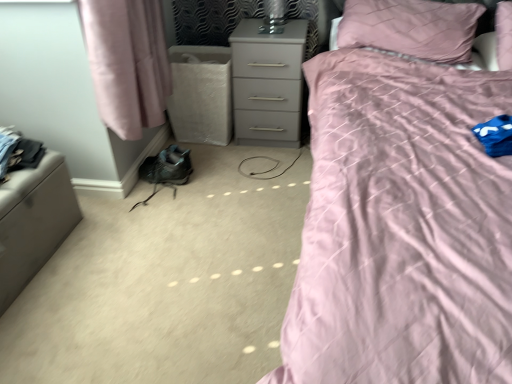
Question: Is matte pink quilt at upper right in front of or behind dark gray fabric at left in the image?

Choices:
 (A) behind
 (B) front

Answer: (B)

Question: Considering the positions of point (326, 148) and point (1, 140), is point (326, 148) closer or farther from the camera than point (1, 140)?

Choices:
 (A) closer
 (B) farther

Answer: (A)

Question: Estimate the real-world distances between objects in this image. Which object is closer to the matte pink quilt at upper right?

Choices:
 (A) dark gray fabric at left
 (B) matte gray nightstand at center
 (C) satin gray ottoman at left
 (D) pink quilted pillow at upper right

Answer: (D)

Question: Based on their relative distances, which object is nearer to the dark gray fabric at left?

Choices:
 (A) satin gray ottoman at left
 (B) matte gray nightstand at center
 (C) pink quilted pillow at upper right
 (D) matte pink quilt at upper right

Answer: (A)